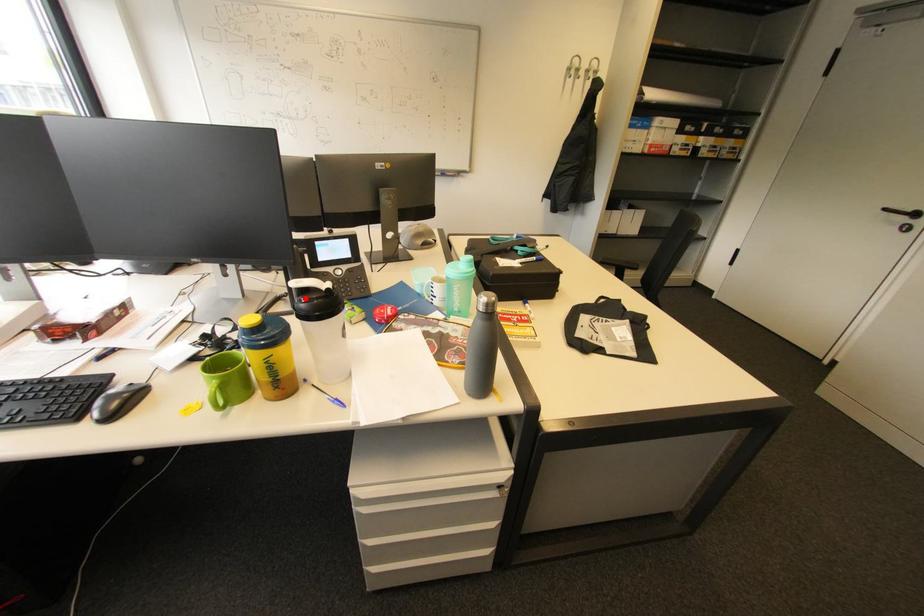
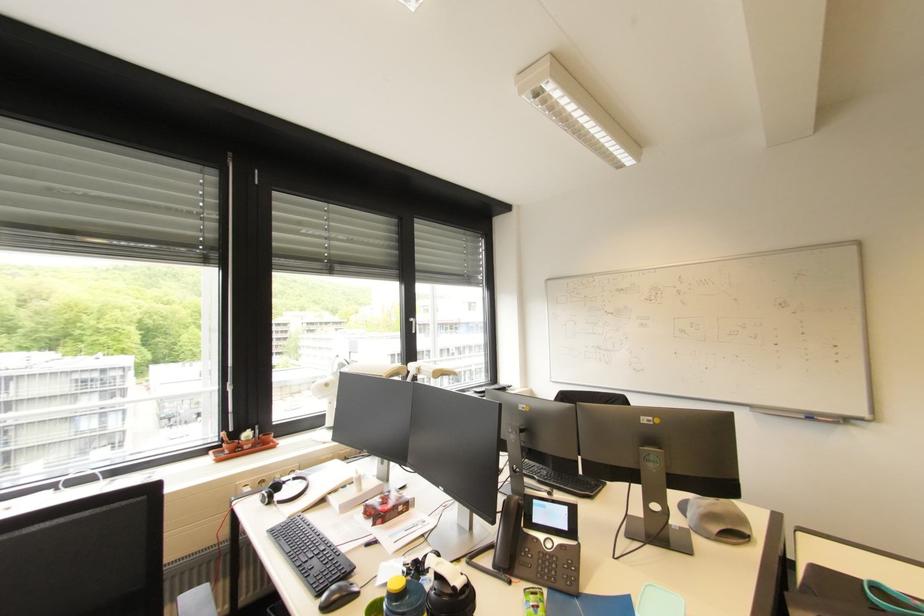
Find the pixel in the second image that matches the highlighted location in the first image.

(441, 583)